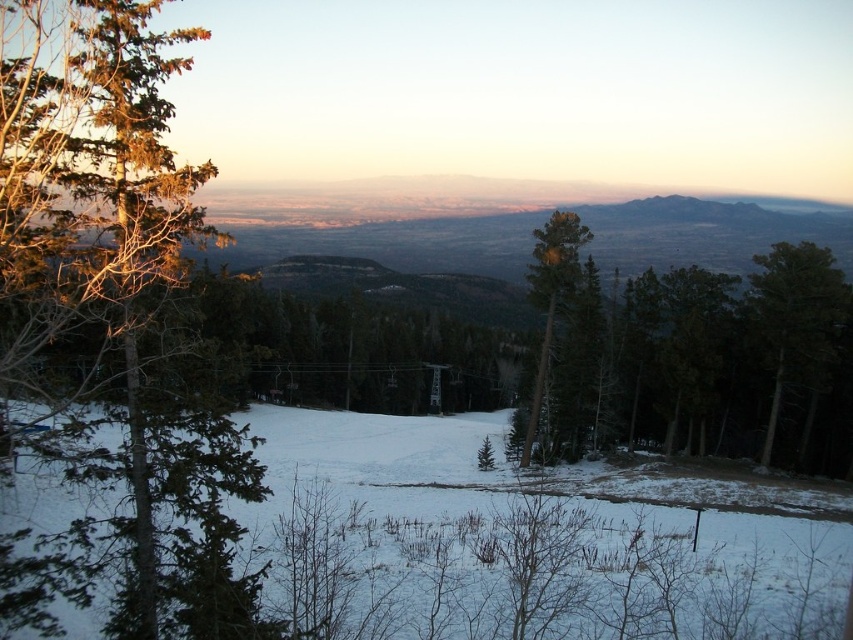
You are standing at the center of the winter landscape and want to find the green matte tree at left. According to the coordinates provided, in which direction should you look to locate it?

The green matte tree at left is located at coordinates point [109,326], which corresponds to the left side of the scene. Therefore, you should look to your left to find it.

You are planning to take a photo of the green matte tree at left and the green matte tree at right in the winter landscape. Which tree should you focus on first if you want to capture the one that appears bigger in the photo?

The green matte tree at left should be focused on first because it has a larger size compared to the green matte tree at right, making it appear bigger in the photo.

You are a skier planning to jump from the white snow ski slope at center to the green matte tree at center. Given that your maximum jump distance is 20 meters, will you be able to reach the tree?

The distance between the white snow ski slope at center and the green matte tree at center is 21.08 meters, which is beyond your maximum jump distance of 20 meters. Therefore, you will not be able to reach the tree.